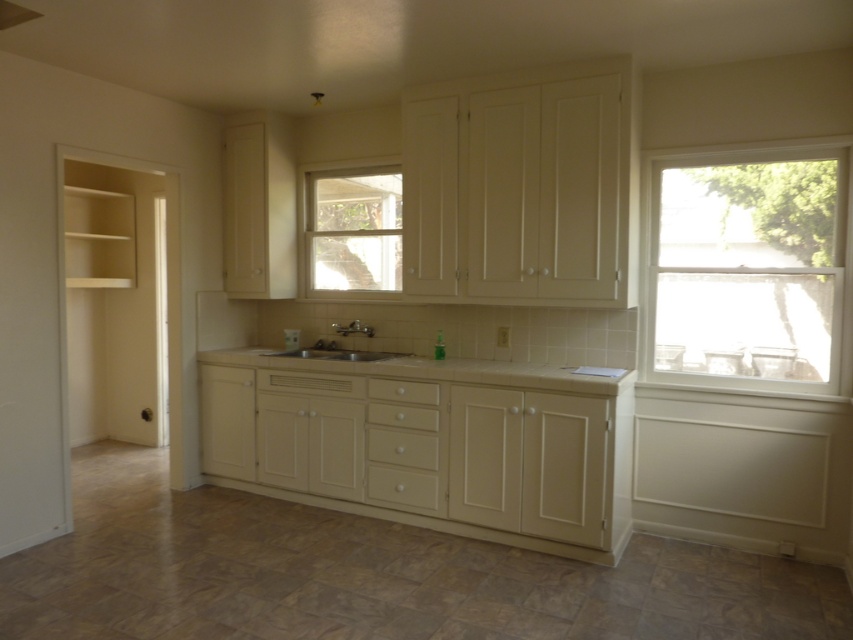
Which is above, clear glass window at center or white glossy sink at center?

clear glass window at center

Between point (329, 246) and point (407, 353), which one is positioned in front?

Point (407, 353)

The height and width of the screenshot is (640, 853). I want to click on clear glass window at center, so click(352, 228).

Who is higher up, clear glass window at right or beige tile countertop at center?

clear glass window at right is above.

Can you confirm if clear glass window at right is bigger than beige tile countertop at center?

Yes, clear glass window at right is bigger than beige tile countertop at center.

The width and height of the screenshot is (853, 640). What are the coordinates of `clear glass window at right` in the screenshot? It's located at (747, 268).

Can you confirm if white laminate countertop at center is positioned above clear glass window at center?

No, white laminate countertop at center is not above clear glass window at center.

In the scene shown: Does white laminate countertop at center have a larger size compared to clear glass window at center?

Correct, white laminate countertop at center is larger in size than clear glass window at center.

Image resolution: width=853 pixels, height=640 pixels. What do you see at coordinates (428, 444) in the screenshot?
I see `white laminate countertop at center` at bounding box center [428, 444].

I want to click on white laminate countertop at center, so click(x=428, y=444).